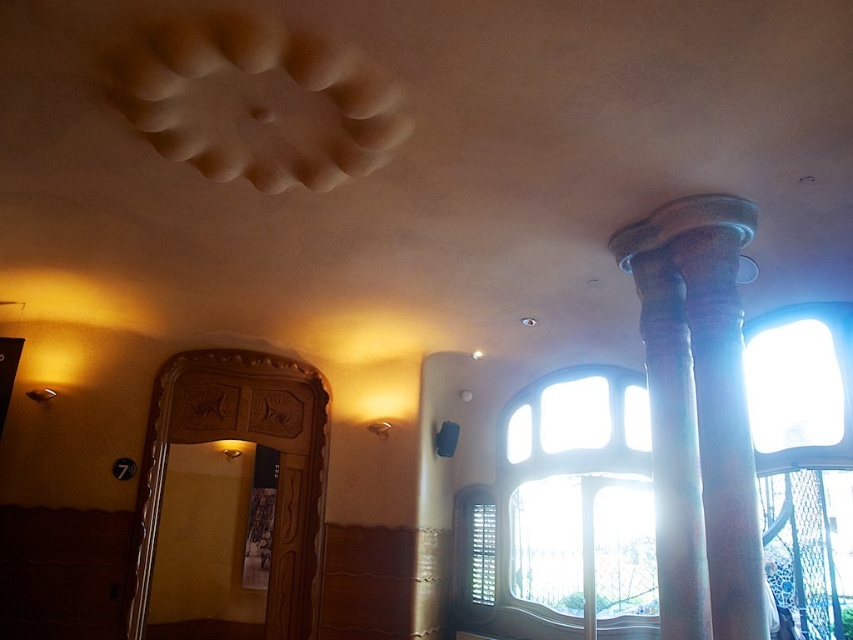
Which is below, smooth stone column at right or clear glass window at center?

Positioned lower is clear glass window at center.

What do you see at coordinates (698, 413) in the screenshot? The height and width of the screenshot is (640, 853). I see `smooth stone column at right` at bounding box center [698, 413].

Between point (720, 460) and point (585, 410), which one is positioned behind?

Point (585, 410)

The image size is (853, 640). What are the coordinates of `smooth stone column at right` in the screenshot? It's located at (698, 413).